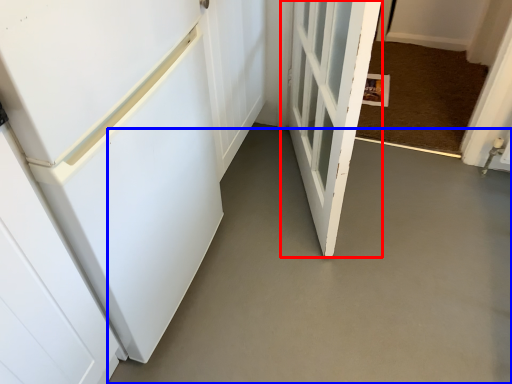
Question: Which object is further to the camera taking this photo, door (highlighted by a red box) or concrete (highlighted by a blue box)?

Choices:
 (A) door
 (B) concrete

Answer: (B)